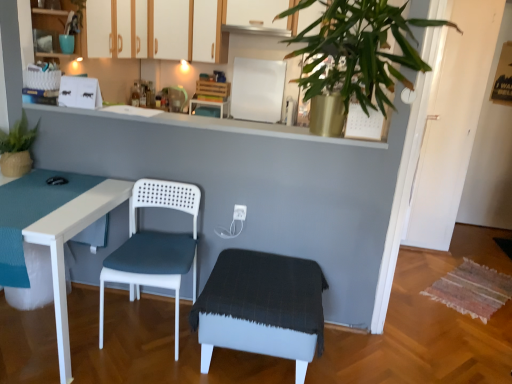
You are a GUI agent. You are given a task and a screenshot of the screen. Output one action in this format:
    pyautogui.click(x=<x>, y=<y>)
    Task: Click on the gold metallic pot at upper center
    The height and width of the screenshot is (384, 512).
    Given the screenshot: What is the action you would take?
    pyautogui.click(x=358, y=50)

This screenshot has width=512, height=384. Describe the element at coordinates (55, 26) in the screenshot. I see `matte blue cup at upper left, which is the third cabinetry in right-to-left order` at that location.

Where is `matte blue cup at upper left, positioned as the first cabinetry in left-to-right order`? This screenshot has width=512, height=384. matte blue cup at upper left, positioned as the first cabinetry in left-to-right order is located at coordinates (55, 26).

Describe the element at coordinates (155, 247) in the screenshot. I see `white plastic chair at center` at that location.

What do you see at coordinates (170, 29) in the screenshot?
I see `white wood cabinets at upper center, marked as the second cabinetry in a left-to-right arrangement` at bounding box center [170, 29].

Measure the distance between teal glossy cup at upper left and camera.

teal glossy cup at upper left and camera are 8.30 feet apart from each other.

What do you see at coordinates (207, 31) in the screenshot? Image resolution: width=512 pixels, height=384 pixels. I see `white matte cabinet at upper center, the third cabinetry in the left-to-right sequence` at bounding box center [207, 31].

The height and width of the screenshot is (384, 512). Identify the location of gold metallic pot at upper center. (358, 50).

From the image's perspective, is matte blue cup at upper left, positioned as the first cabinetry in left-to-right order, located above or below teal glossy cup at upper left?

Based on their image positions, matte blue cup at upper left, positioned as the first cabinetry in left-to-right order, is located above teal glossy cup at upper left.

Considering the sizes of matte blue cup at upper left, which is the third cabinetry in right-to-left order, and teal glossy cup at upper left in the image, is matte blue cup at upper left, which is the third cabinetry in right-to-left order, bigger or smaller than teal glossy cup at upper left?

matte blue cup at upper left, which is the third cabinetry in right-to-left order, is bigger than teal glossy cup at upper left.

Is matte blue cup at upper left, positioned as the first cabinetry in left-to-right order, not close to teal glossy cup at upper left?

No, matte blue cup at upper left, positioned as the first cabinetry in left-to-right order, is not far from teal glossy cup at upper left.

From a real-world perspective, is gold metallic pot at upper center physically located above or below white matte cabinet at upper center, the first cabinetry in the right-to-left sequence?

In terms of real-world spatial position, gold metallic pot at upper center is below white matte cabinet at upper center, the first cabinetry in the right-to-left sequence.

Are gold metallic pot at upper center and white matte cabinet at upper center, positioned as the 1th cabinetry in back-to-front order, located far from each other?

Yes.

Locate an element on the screen. vegetation lying below the white matte cabinet at upper center, placed as the third cabinetry when sorted from front to back (from the image's perspective) is located at coordinates (358, 50).

Is point (402, 9) less distant than point (199, 39)?

Yes, it is in front of point (199, 39).

Who is taller, white wood cabinets at upper center, marked as the second cabinetry in a left-to-right arrangement, or white fabric step stool at center?

Standing taller between the two is white wood cabinets at upper center, marked as the second cabinetry in a left-to-right arrangement.

Considering their positions, is white wood cabinets at upper center, which ranks as the second cabinetry in back-to-front order, located in front of or behind white fabric step stool at center?

white wood cabinets at upper center, which ranks as the second cabinetry in back-to-front order, is behind white fabric step stool at center.

In the scene shown: Between white wood cabinets at upper center, marked as the second cabinetry in a left-to-right arrangement, and white fabric step stool at center, which one has smaller width?

Thinner between the two is white wood cabinets at upper center, marked as the second cabinetry in a left-to-right arrangement.

Is white fabric step stool at center at the back of white wood cabinets at upper center, the second cabinetry positioned from the front?

white wood cabinets at upper center, the second cabinetry positioned from the front, is not turned away from white fabric step stool at center.

Is matte green plant at left placed right next to white fabric step stool at center?

No, matte green plant at left is not in contact with white fabric step stool at center.

From a real-world perspective, who is located lower, matte green plant at left or white fabric step stool at center?

white fabric step stool at center is physically lower.

Locate an element on the screen. This screenshot has width=512, height=384. houseplant above the white fabric step stool at center (from the image's perspective) is located at coordinates (17, 148).

How distant is matte green plant at left from white fabric step stool at center?

The distance of matte green plant at left from white fabric step stool at center is 4.59 feet.

This screenshot has width=512, height=384. In order to click on houseplant in front of the white plastic electric outlet at center in this screenshot , I will do `click(17, 148)`.

Is matte green plant at left at the left side of white plastic electric outlet at center?

Correct, you'll find matte green plant at left to the left of white plastic electric outlet at center.

Who is bigger, matte green plant at left or white plastic electric outlet at center?

matte green plant at left.

Is white wood cabinets at upper center, the second cabinetry positioned from the front, far away from matte green plant at left?

Yes, white wood cabinets at upper center, the second cabinetry positioned from the front, and matte green plant at left are quite far apart.

Consider the image. Is white wood cabinets at upper center, the second cabinetry positioned from the front, situated inside matte green plant at left or outside?

white wood cabinets at upper center, the second cabinetry positioned from the front, is spatially situated outside matte green plant at left.

From a real-world perspective, is white wood cabinets at upper center, the second cabinetry positioned from the front, located beneath matte green plant at left?

No, from a real-world perspective, white wood cabinets at upper center, the second cabinetry positioned from the front, is not below matte green plant at left.

In terms of width, does white wood cabinets at upper center, the second cabinetry positioned from the front, look wider or thinner when compared to matte green plant at left?

Clearly, white wood cabinets at upper center, the second cabinetry positioned from the front, has more width compared to matte green plant at left.

Visually, is gold metallic pot at upper center positioned to the left or to the right of teal glossy cup at upper left?

gold metallic pot at upper center is to the right of teal glossy cup at upper left.

From a real-world perspective, is gold metallic pot at upper center physically located above or below teal glossy cup at upper left?

gold metallic pot at upper center is situated higher than teal glossy cup at upper left in the real world.

Is point (379, 24) less distant than point (68, 42)?

Yes, point (379, 24) is in front of point (68, 42).

Who is more distant, gold metallic pot at upper center or teal glossy cup at upper left?

teal glossy cup at upper left is further away from the camera.

You are a GUI agent. You are given a task and a screenshot of the screen. Output one action in this format:
    pyautogui.click(x=<x>, y=<y>)
    Task: Click on the cabinetry in front of the teal glossy cup at upper left
    The width and height of the screenshot is (512, 384).
    Given the screenshot: What is the action you would take?
    pyautogui.click(x=55, y=26)

From a real-world perspective, which cabinetry is the 3rd one above the gold metallic pot at upper center? Please provide its 2D coordinates.

[(207, 31)]

Looking at the image, which one is located further to matte green plant at left, white matte table at left or matte blue cup at upper left, marked as the 3th cabinetry in a back-to-front arrangement?

The object further to matte green plant at left is matte blue cup at upper left, marked as the 3th cabinetry in a back-to-front arrangement.

Looking at the image, which one is located closer to white matte table at left, white plastic chair at center or white fabric step stool at center?

white plastic chair at center.

Based on their spatial positions, is teal glossy cup at upper left or white fabric step stool at center closer to matte blue cup at upper left, marked as the first cabinetry in a front-to-back arrangement?

Among the two, teal glossy cup at upper left is located nearer to matte blue cup at upper left, marked as the first cabinetry in a front-to-back arrangement.

Looking at the image, which one is located further to matte blue cup at upper left, marked as the 3th cabinetry in a back-to-front arrangement, white wood cabinets at upper center, marked as the second cabinetry in a left-to-right arrangement, or gold metallic pot at upper center?

Among the two, gold metallic pot at upper center is located further to matte blue cup at upper left, marked as the 3th cabinetry in a back-to-front arrangement.

Based on the photo, looking at the image, which one is located further to gold metallic pot at upper center, white plastic chair at center or white fabric step stool at center?

white plastic chair at center.

Based on their spatial positions, is matte blue cup at upper left, marked as the 3th cabinetry in a back-to-front arrangement, or teal glossy cup at upper left closer to white plastic electric outlet at center?

teal glossy cup at upper left is positioned closer to the anchor white plastic electric outlet at center.

Based on their spatial positions, is white wood cabinets at upper center, marked as the second cabinetry in a left-to-right arrangement, or white plastic chair at center closer to white matte cabinet at upper center, placed as the third cabinetry when sorted from front to back?

white wood cabinets at upper center, marked as the second cabinetry in a left-to-right arrangement, is positioned closer to the anchor white matte cabinet at upper center, placed as the third cabinetry when sorted from front to back.

Based on their spatial positions, is white matte table at left or white fabric step stool at center closer to white plastic chair at center?

The object closer to white plastic chair at center is white matte table at left.

Locate an element on the screen. houseplant between white matte table at left and white matte cabinet at upper center, positioned as the 1th cabinetry in back-to-front order, in the front-back direction is located at coordinates (17, 148).

I want to click on electric outlet positioned between gold metallic pot at upper center and white wood cabinets at upper center, the second cabinetry positioned from the front, from near to far, so tap(239, 212).

The image size is (512, 384). I want to click on table between matte green plant at left and white plastic chair at center, so click(x=63, y=248).

At what (x,y) coordinates should I click in order to perform the action: click on table that lies between matte blue cup at upper left, which is the third cabinetry in right-to-left order, and white plastic chair at center from top to bottom. Please return your answer as a coordinate pair (x, y). Looking at the image, I should click on (63, 248).